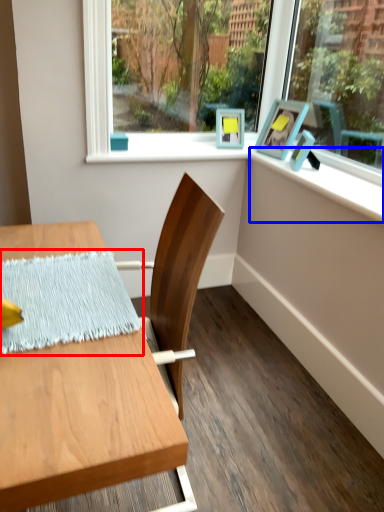
Question: Which of the following is the closest to the observer, blanket (highlighted by a red box) or window sill (highlighted by a blue box)?

Choices:
 (A) blanket
 (B) window sill

Answer: (A)